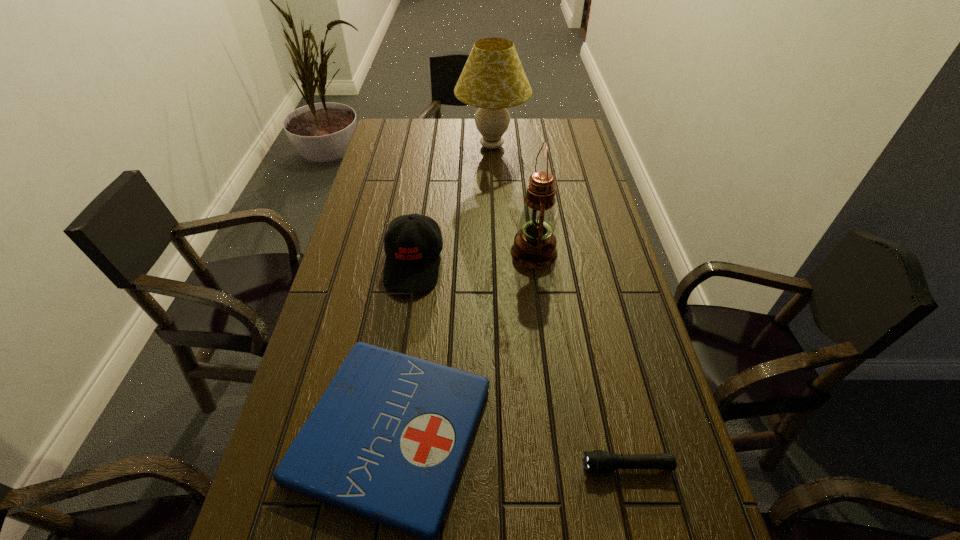
Where is `lampshade`? Image resolution: width=960 pixels, height=540 pixels. lampshade is located at coordinates (493, 79).

You are a GUI agent. You are given a task and a screenshot of the screen. Output one action in this format:
    pyautogui.click(x=<x>, y=<y>)
    Task: Click on the oil lamp
    Image resolution: width=960 pixels, height=540 pixels.
    Given the screenshot: What is the action you would take?
    pyautogui.click(x=534, y=246)

In order to click on baseball cap in this screenshot , I will do `click(412, 263)`.

The image size is (960, 540). Find the location of `flashlight`. flashlight is located at coordinates (598, 461).

What are the coordinates of `free space located on the front of the farthest object` in the screenshot? It's located at (494, 218).

The image size is (960, 540). What are the coordinates of `vacant area situated 0.090m on the left of the oil lamp` in the screenshot? It's located at (480, 252).

Find the location of a particular element. The height and width of the screenshot is (540, 960). free space located on the front-facing side of the baseball cap is located at coordinates (396, 381).

Find the location of a particular element. free space located at the lens end of the flashlight is located at coordinates (476, 465).

Locate an element on the screen. This screenshot has width=960, height=540. free location located 0.370m at the lens end of the flashlight is located at coordinates (395, 465).

Identify the location of vacant space located at the lens end of the flashlight. (405, 465).